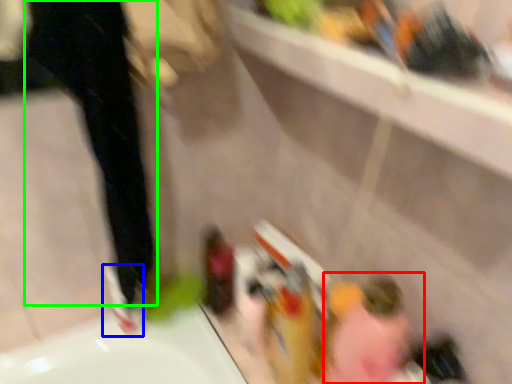
Question: Considering the real-world distances, which object is closest to woman (highlighted by a red box)? shoe (highlighted by a blue box) or pants (highlighted by a green box).

Choices:
 (A) shoe
 (B) pants

Answer: (A)